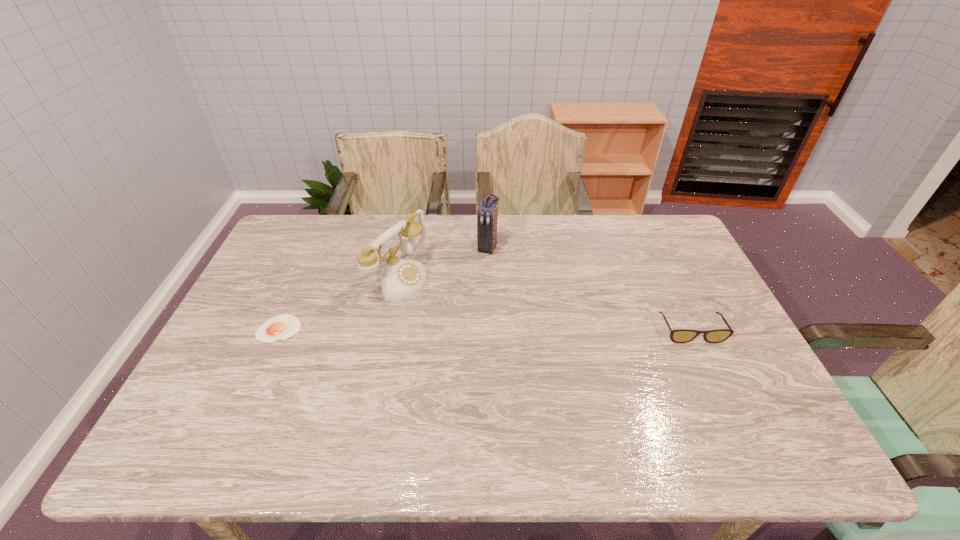
Find the location of a particular element. blank region between the second object from left to right and the rightmost object is located at coordinates (545, 303).

Locate an element on the screen. This screenshot has height=540, width=960. vacant space in between the clutch bag and the third object from right to left is located at coordinates (444, 261).

In order to click on free spot between the telephone and the egg yolk in this screenshot , I will do `click(340, 302)`.

In order to click on the closest object to the second object from right to left in this screenshot , I will do `click(401, 278)`.

Identify which object is located as the third nearest to the third object from right to left. Please provide its 2D coordinates. Your answer should be formatted as a tuple, i.e. [(x, y)], where the tuple contains the x and y coordinates of a point satisfying the conditions above.

[(678, 335)]

I want to click on vacant space that satisfies the following two spatial constraints: 1. on the back side of the second object from left to right; 2. on the left side of the third object from left to right, so pos(405,247).

At what (x,y) coordinates should I click in order to perform the action: click on free location that satisfies the following two spatial constraints: 1. on the back side of the leftmost object; 2. on the right side of the third object from left to right. Please return your answer as a coordinate pair (x, y). Looking at the image, I should click on (316, 247).